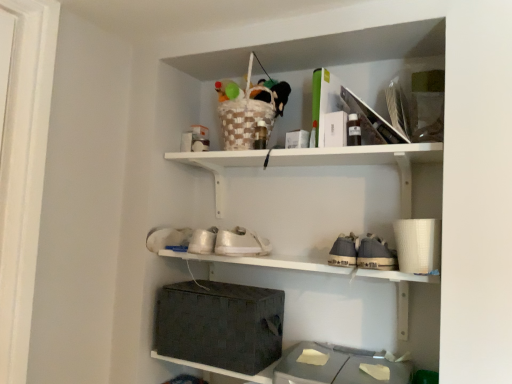
Question: In terms of size, does white matte shoe at lower left, the first shoe in the left-to-right sequence, appear bigger or smaller than woven fabric basket at center, which appears as the 1th shelf when ordered from the bottom?

Choices:
 (A) small
 (B) big

Answer: (A)

Question: Is point (182, 235) positioned closer to the camera than point (168, 256)?

Choices:
 (A) closer
 (B) farther

Answer: (B)

Question: Which is nearer to the white matte shelf at upper center, which is the second shelf in bottom-to-top order?

Choices:
 (A) gray woven basket at lower center, the first storage box when ordered from right to left
 (B) woven fabric basket at center, which ranks as the 2th shelf in top-to-bottom order
 (C) white matte shoe at center, which is counted as the 2th shoe, starting from the left
 (D) woven fabric storage box at lower center, the 2th storage box in the right-to-left sequence
 (E) white matte shoe at lower left, the first shoe in the left-to-right sequence

Answer: (B)

Question: Which of these objects is positioned farthest from the gray woven basket at lower center, which ranks as the 2th storage box in left-to-right order?

Choices:
 (A) woven fabric storage box at lower center, the 2th storage box in the right-to-left sequence
 (B) white matte shoe at center, which is counted as the 2th shoe, starting from the left
 (C) white matte shelf at upper center, the first shelf positioned from the top
 (D) woven fabric basket at center, which appears as the 1th shelf when ordered from the bottom
 (E) white matte shoe at lower left, which is the 2th shoe from right to left

Answer: (E)